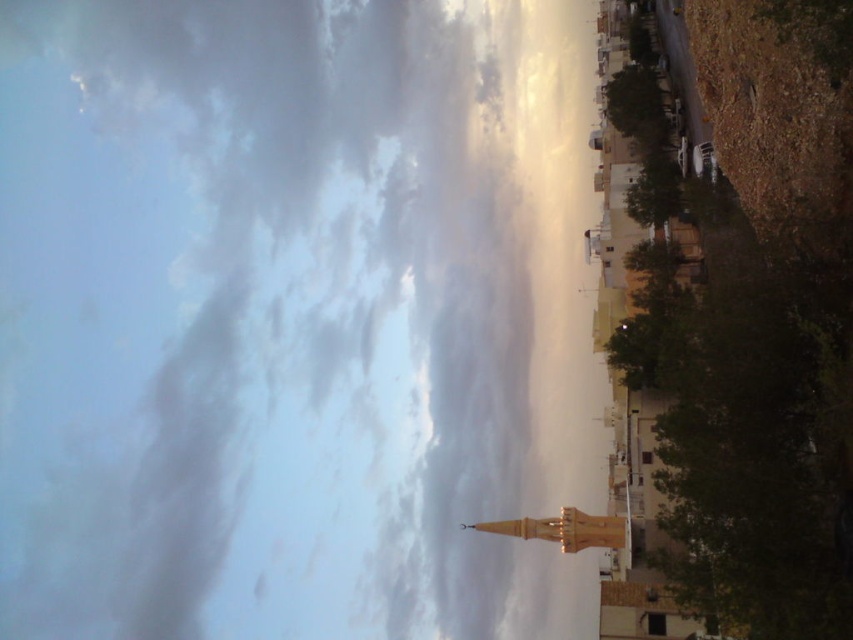
Question: Is cloudy sky at upper center bigger than light brown wooden tower at lower center?

Choices:
 (A) no
 (B) yes

Answer: (B)

Question: Can you confirm if cloudy sky at upper center is positioned above light brown wooden tower at lower center?

Choices:
 (A) no
 (B) yes

Answer: (B)

Question: Does cloudy sky at upper center lie in front of light brown wooden tower at lower center?

Choices:
 (A) yes
 (B) no

Answer: (B)

Question: Which point is farther to the camera?

Choices:
 (A) (625, 524)
 (B) (157, 70)

Answer: (B)

Question: Which point appears closest to the camera in this image?

Choices:
 (A) (561, 515)
 (B) (430, 612)

Answer: (A)